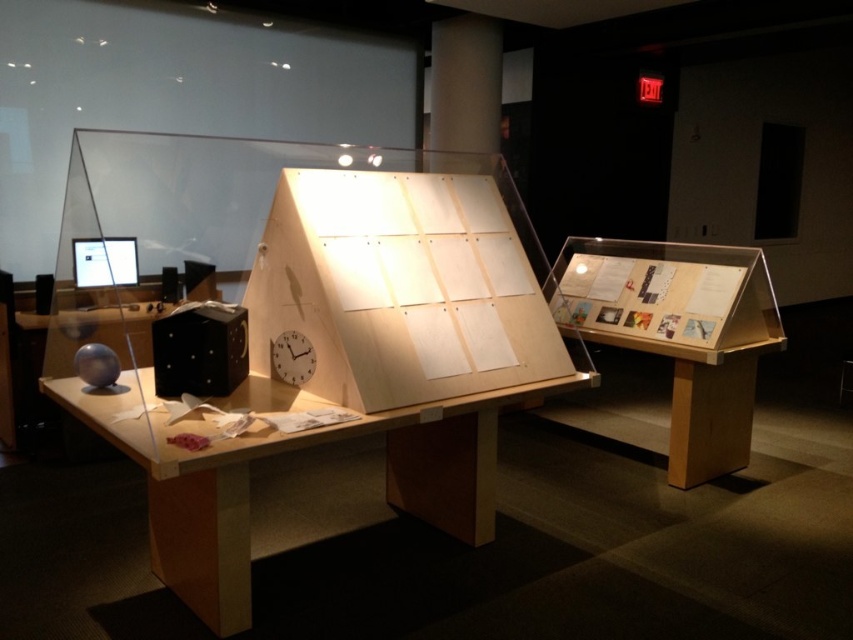
Question: Does light brown wood table at center appear over white matte clock at center?

Choices:
 (A) yes
 (B) no

Answer: (B)

Question: Among these points, which one is nearest to the camera?

Choices:
 (A) (741, 429)
 (B) (288, 362)
 (C) (263, 433)

Answer: (C)

Question: Is the position of light brown wood table at center less distant than that of white matte clock at center?

Choices:
 (A) yes
 (B) no

Answer: (A)

Question: Which object is positioned closest to the wooden display case at right?

Choices:
 (A) white matte clock at center
 (B) light brown wood table at center

Answer: (B)

Question: Is wooden display case at right to the left of white matte clock at center from the viewer's perspective?

Choices:
 (A) yes
 (B) no

Answer: (B)

Question: Which of these objects is positioned closest to the light brown wood table at center?

Choices:
 (A) white matte clock at center
 (B) wooden display case at right

Answer: (A)